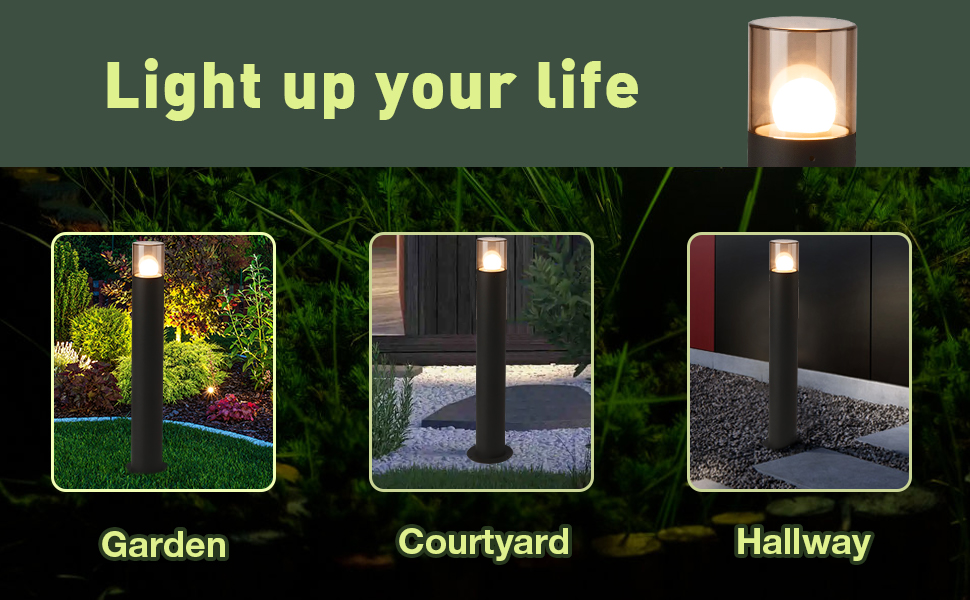
Identify the location of light bulb cover. The image size is (970, 600). (822, 30).